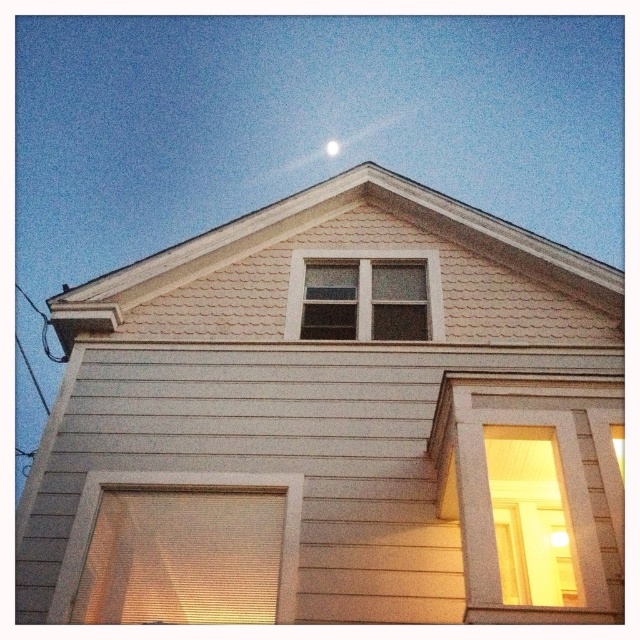
You are standing in front of the residential building and notice two points marked on the image. The first point is at coordinate point (422,419) and the second is at point (241,474). Which point is closer to you?

Point (422,419) is further to the camera than point (241,474), so the point closer to you is point (241,474).

You are standing in front of the residential building and want to enter through the matte wooden door at right. As you look up, you notice the white glossy moon at upper center. Which object is nearer to you, the door or the moon?

The matte wooden door at right is closer to the viewer than the white glossy moon at upper center, so the door is nearer to you.